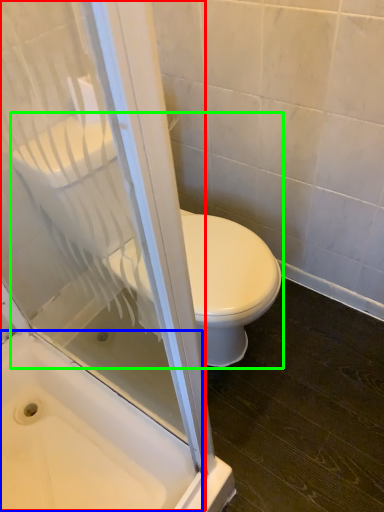
Question: Which object is the closest to the screen door (highlighted by a red box)? Choose among these: bath (highlighted by a blue box) or toilet (highlighted by a green box).

Choices:
 (A) bath
 (B) toilet

Answer: (A)